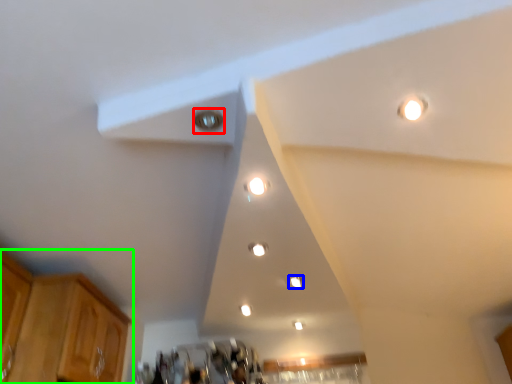
Question: Which object is the closest to the light (highlighted by a red box)? Choose among these: dot (highlighted by a blue box) or cabinetry (highlighted by a green box).

Choices:
 (A) dot
 (B) cabinetry

Answer: (A)